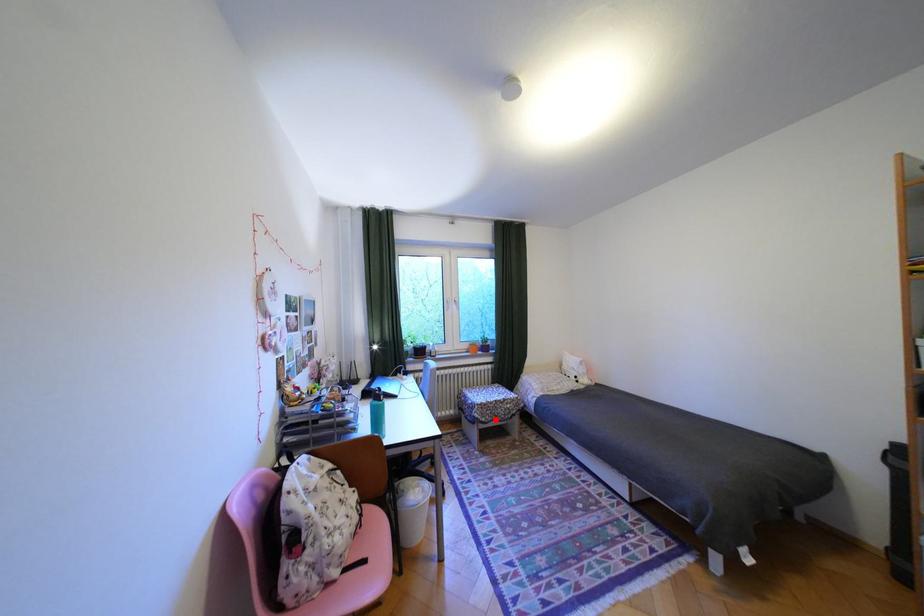
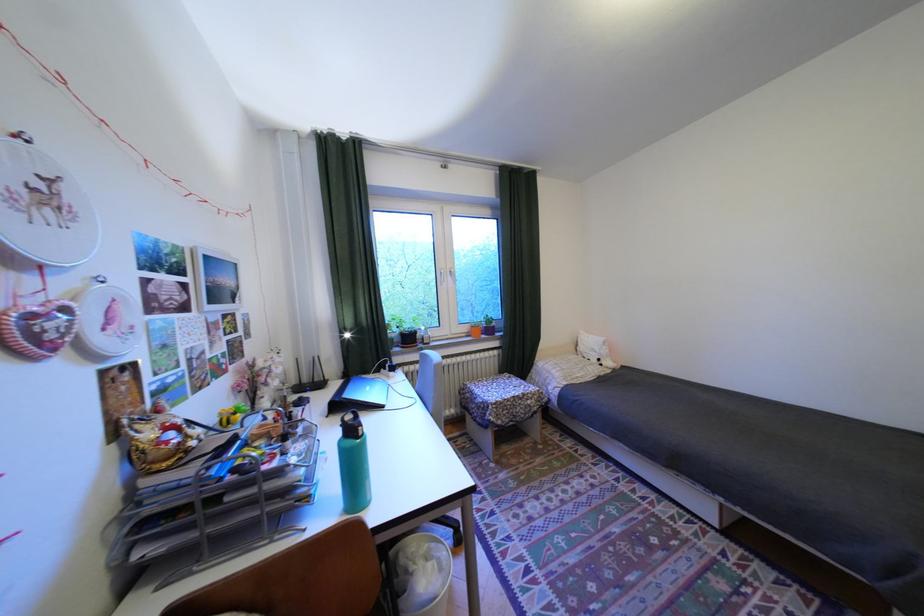
Locate, in the second image, the point that corresponds to the highlighted location in the first image.

(512, 422)